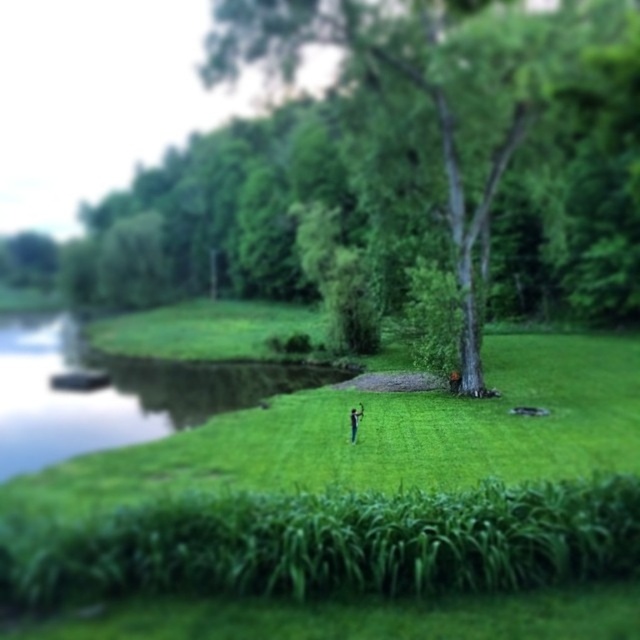
Question: Among these objects, which one is nearest to the camera?

Choices:
 (A) green leafy tree at center
 (B) blue fabric person at center
 (C) green grassy river at left
 (D) brown leather jacket at center

Answer: (C)

Question: Is green grassy river at left thinner than brown leather jacket at center?

Choices:
 (A) yes
 (B) no

Answer: (B)

Question: Does green leafy tree at center appear on the left side of green grassy river at left?

Choices:
 (A) no
 (B) yes

Answer: (A)

Question: Which point is farther to the camera?

Choices:
 (A) (3, 403)
 (B) (460, 378)
 (C) (356, 419)
 (D) (500, 140)

Answer: (A)

Question: Can you confirm if green leafy tree at center is bigger than brown leather jacket at center?

Choices:
 (A) no
 (B) yes

Answer: (B)

Question: Which point is closer to the camera?

Choices:
 (A) (356, 419)
 (B) (449, 378)
 (C) (161, 403)

Answer: (A)